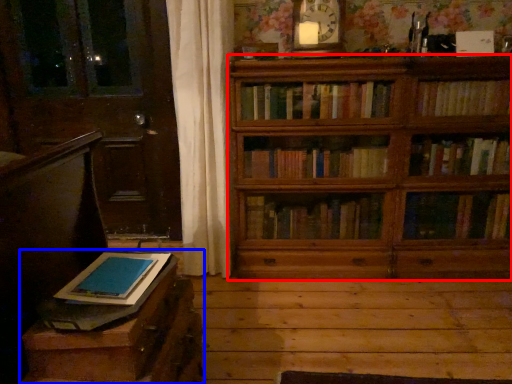
Question: Among these objects, which one is farthest to the camera, bookcase (highlighted by a red box) or table (highlighted by a blue box)?

Choices:
 (A) bookcase
 (B) table

Answer: (A)